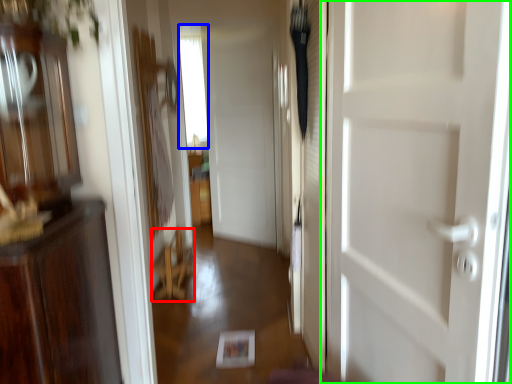
Question: Based on their relative distances, which object is farther from furniture (highlighted by a red box)? Choose from window (highlighted by a blue box) and door (highlighted by a green box).

Choices:
 (A) window
 (B) door

Answer: (A)